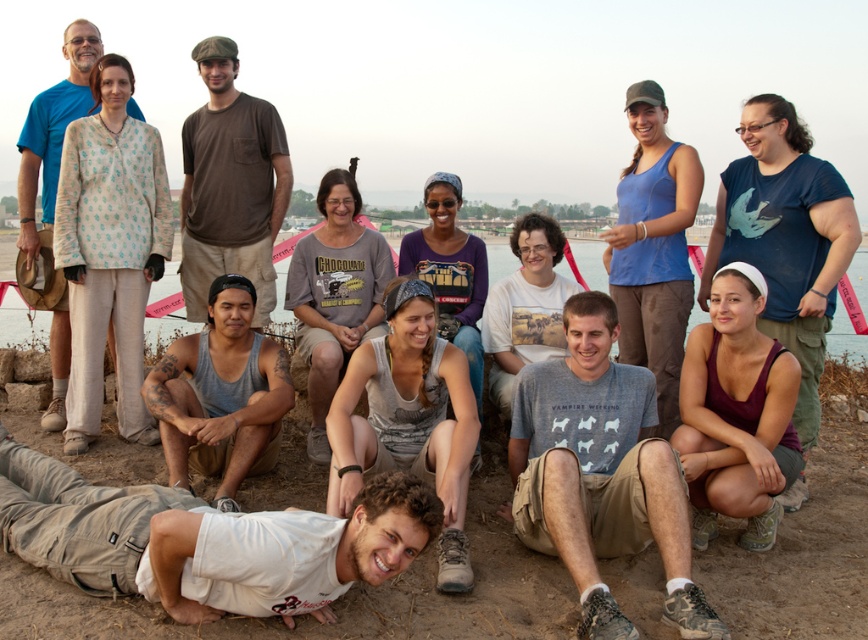
Is point (268, 168) farther from camera compared to point (248, 284)?

Yes.

Who is taller, brown cotton shirt at upper center or gray matte tank top at center?

brown cotton shirt at upper center

Is point (238, 256) closer to viewer compared to point (185, 365)?

No, (238, 256) is behind (185, 365).

Where is `brown cotton shirt at upper center`? brown cotton shirt at upper center is located at coordinates (229, 184).

Which of these two, brown sandy ground at lower center or blue cotton shirt at upper left, stands taller?

With more height is blue cotton shirt at upper left.

The width and height of the screenshot is (868, 640). Describe the element at coordinates (801, 554) in the screenshot. I see `brown sandy ground at lower center` at that location.

You are a GUI agent. You are given a task and a screenshot of the screen. Output one action in this format:
    pyautogui.click(x=<x>, y=<y>)
    Task: Click on the brown sandy ground at lower center
    This screenshot has width=868, height=640.
    Given the screenshot: What is the action you would take?
    pyautogui.click(x=801, y=554)

Where is `white cotton shirt at lower center`? white cotton shirt at lower center is located at coordinates coord(202,540).